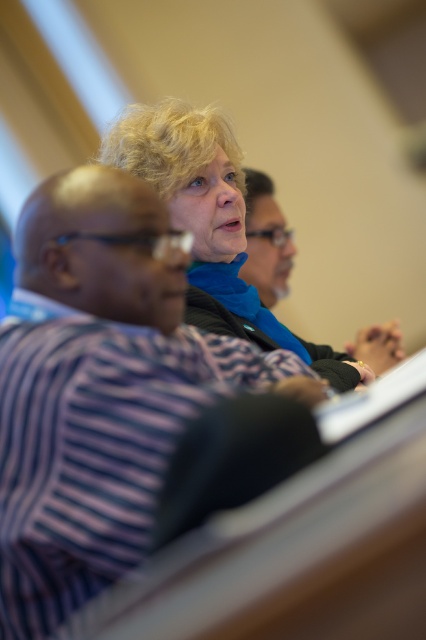
Who is positioned more to the left, purple striped shirt at upper center or matte black shirt at center?

From the viewer's perspective, purple striped shirt at upper center appears more on the left side.

Is point (114, 376) in front of point (382, 344)?

That is True.

Who is more distant from viewer, (112,528) or (261,248)?

The point (261,248) is more distant.

Where is `purple striped shirt at upper center`? purple striped shirt at upper center is located at coordinates (121, 400).